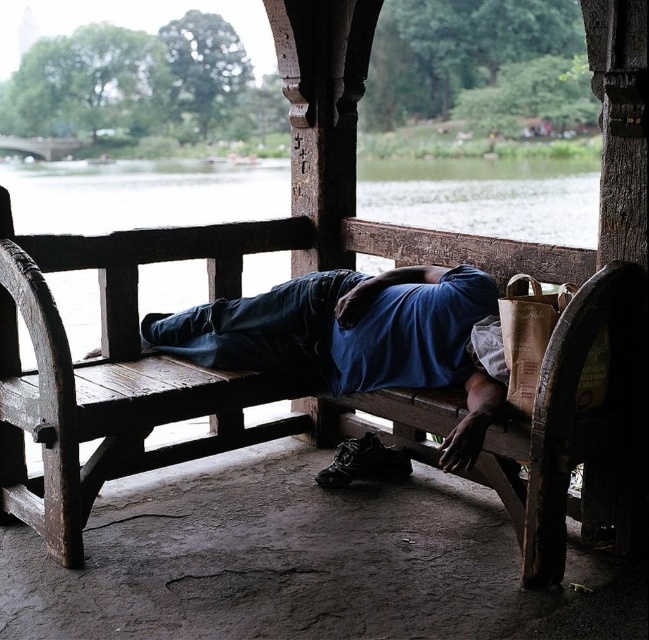
Based on the photo, can you confirm if rustic wood bench at center is positioned to the right of blue fabric at center?

No, rustic wood bench at center is not to the right of blue fabric at center.

Who is more distant from viewer, (434, 232) or (376, 365)?

The point (434, 232) is more distant.

Find the location of a particular element. The image size is (649, 640). rustic wood bench at center is located at coordinates (140, 371).